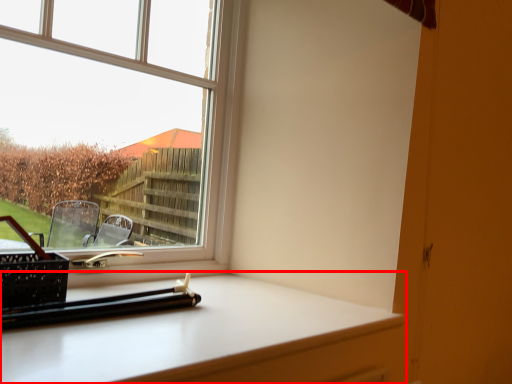
Question: Observing the image, what is the correct spatial positioning of computer desk (annotated by the red box) in reference to window?

Choices:
 (A) right
 (B) left

Answer: (A)